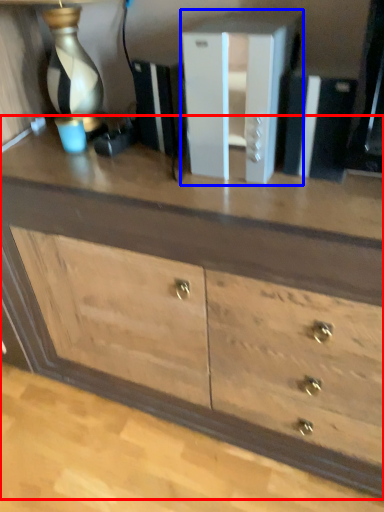
Question: Among these objects, which one is farthest to the camera, chest of drawers (highlighted by a red box) or file cabinet (highlighted by a blue box)?

Choices:
 (A) chest of drawers
 (B) file cabinet

Answer: (B)